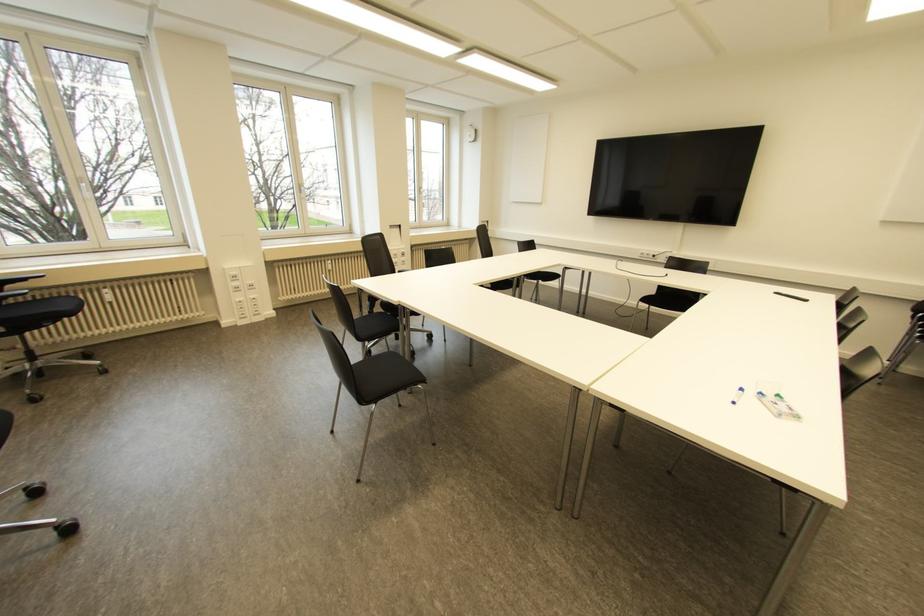
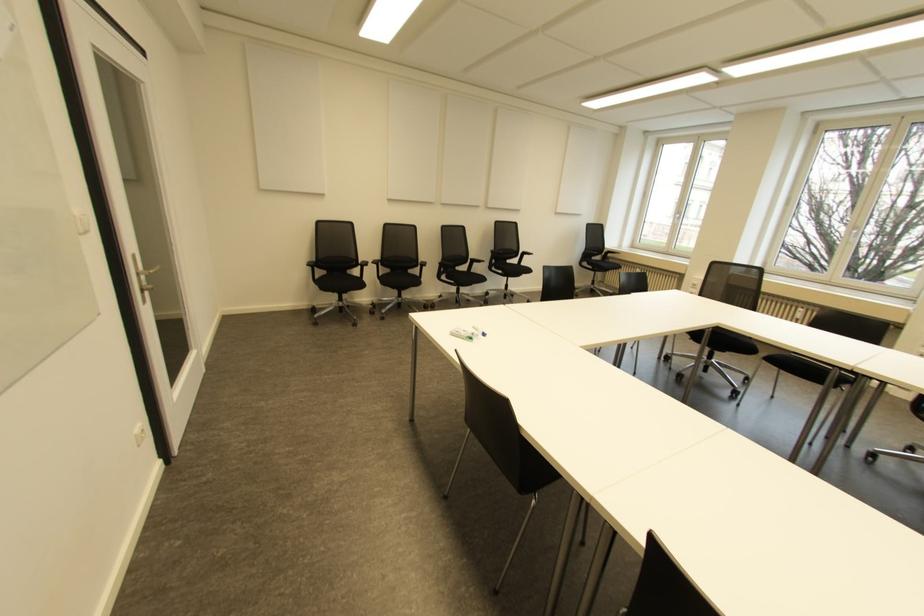
Where in the second image is the point corresponding to (x=777, y=395) from the first image?

(470, 338)